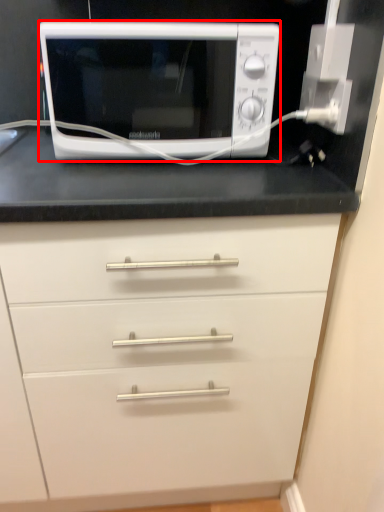
Question: From the image's perspective, what is the correct spatial relationship of microwave oven (annotated by the red box) in relation to electric outlet?

Choices:
 (A) below
 (B) above

Answer: (B)